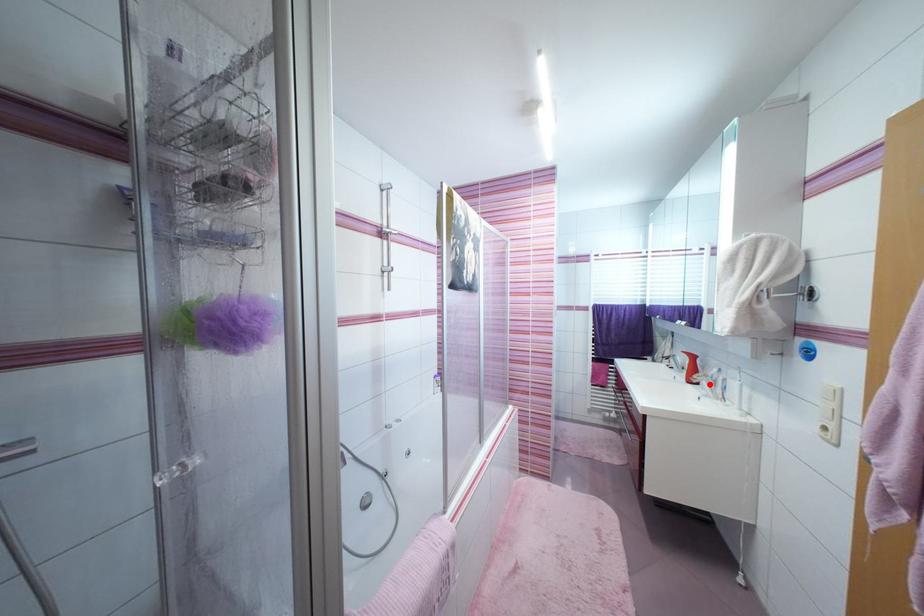
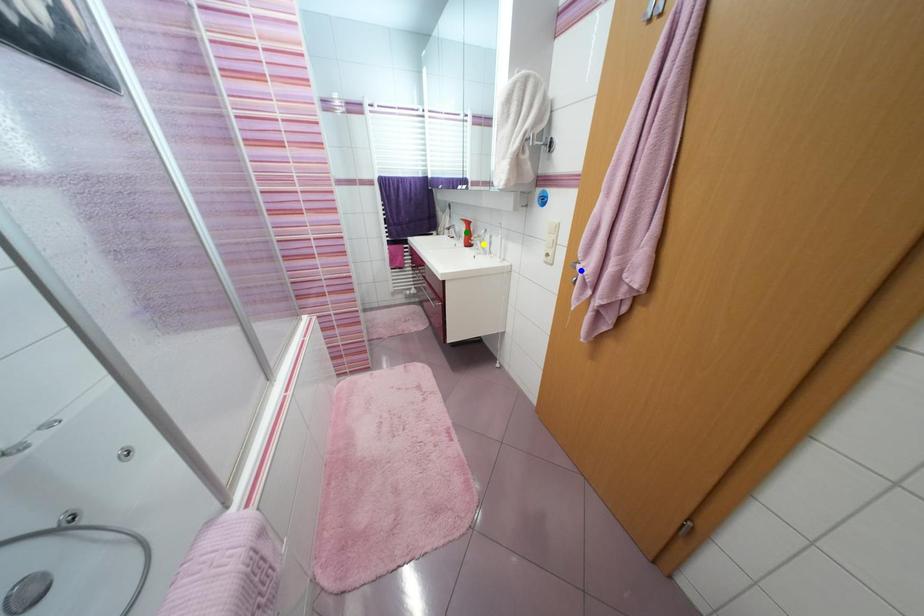
Question: I am providing you with two images of the same scene from different viewpoints. A red point is marked on the first image. You are given multiple points on the second image. In image 2, which mark is for the same physical point as the one in image 1?

Choices:
 (A) green point
 (B) blue point
 (C) yellow point

Answer: (C)